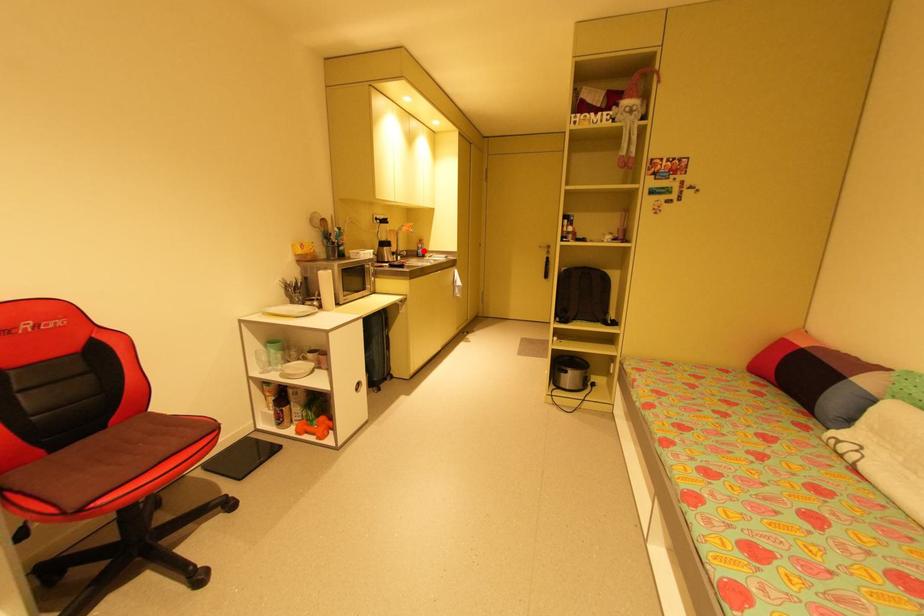
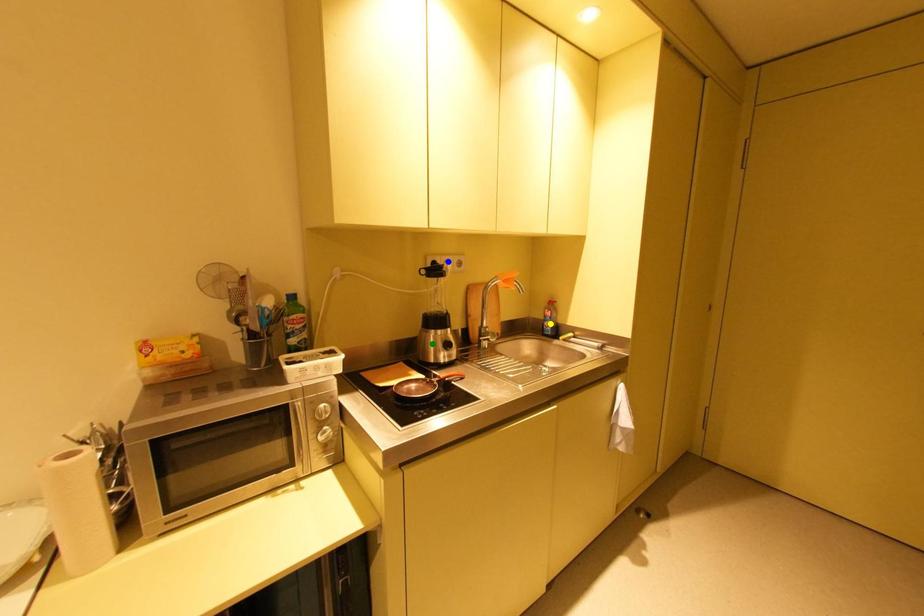
Question: I am providing you with two images of the same scene from different viewpoints. A red point is marked on the first image. You are given multiple points on the second image. Which point in image 2 represents the same 3d spot as the red point in image 1?

Choices:
 (A) yellow point
 (B) green point
 (C) blue point

Answer: (A)